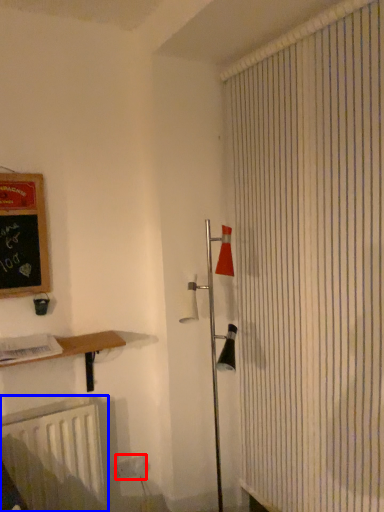
Question: Which point is further to the camera, electric outlet (highlighted by a red box) or radiator (highlighted by a blue box)?

Choices:
 (A) electric outlet
 (B) radiator

Answer: (A)